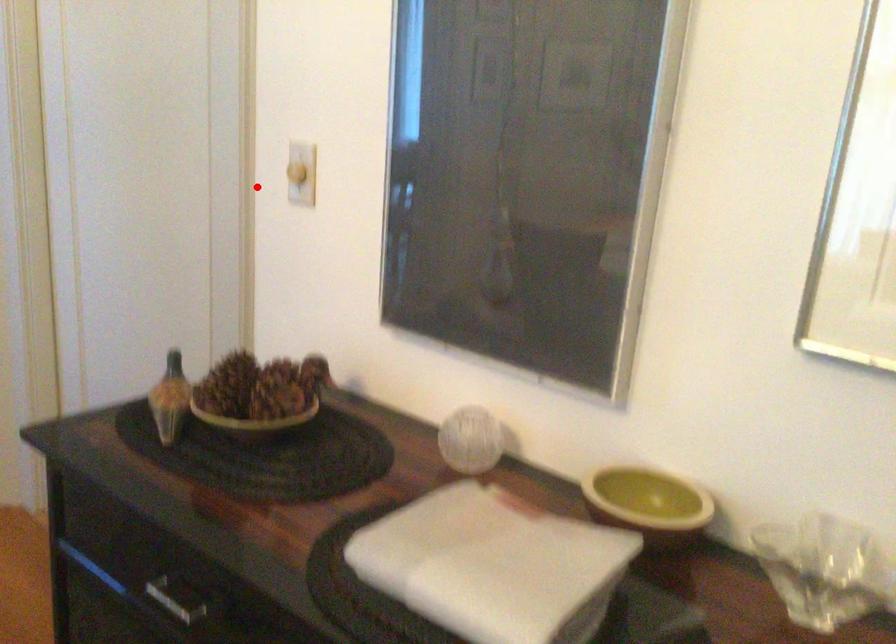
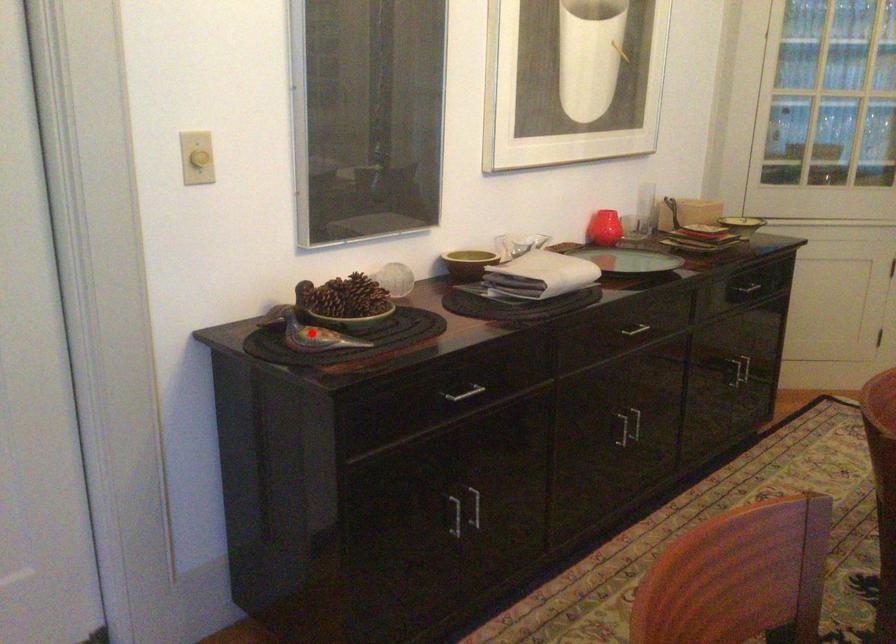
I am providing you with two images of the same scene from different viewpoints. A red point is marked on the first image and another point is marked on the second image. Does the point marked in image1 correspond to the same location as the one in image2?

No